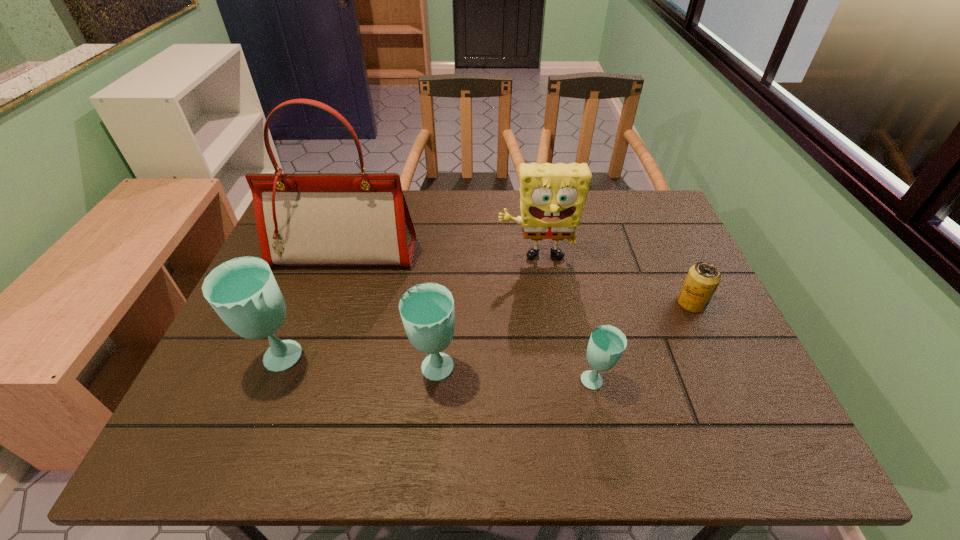
All glasss are currently evenly spaced. To continue this pattern, where would you add another glass on the right? Please point out a vacant spot. Please provide its 2D coordinates. Your answer should be formatted as a tuple, i.e. [(x, y)], where the tuple contains the x and y coordinates of a point satisfying the conditions above.

[(763, 392)]